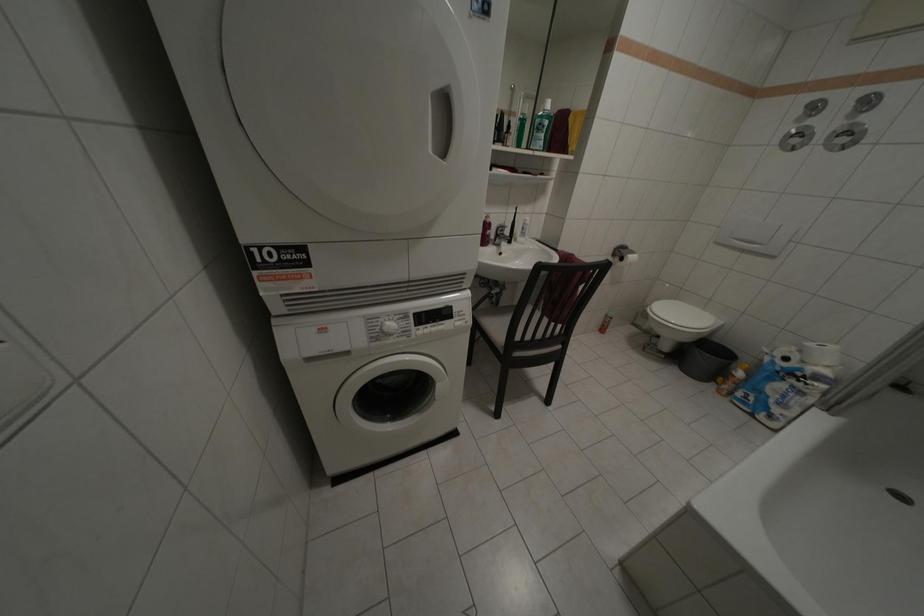
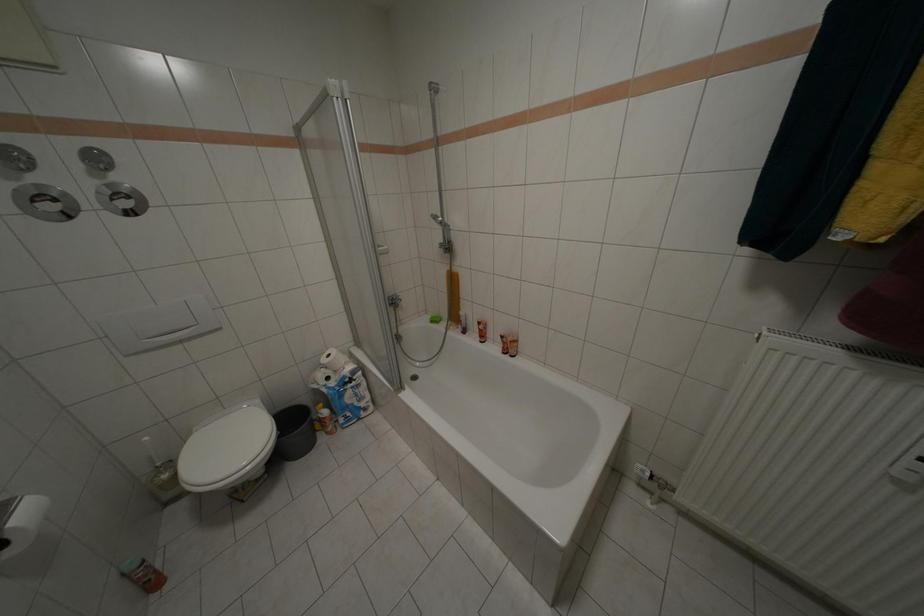
How did the camera likely rotate?

The rotation direction of the camera is right-down.